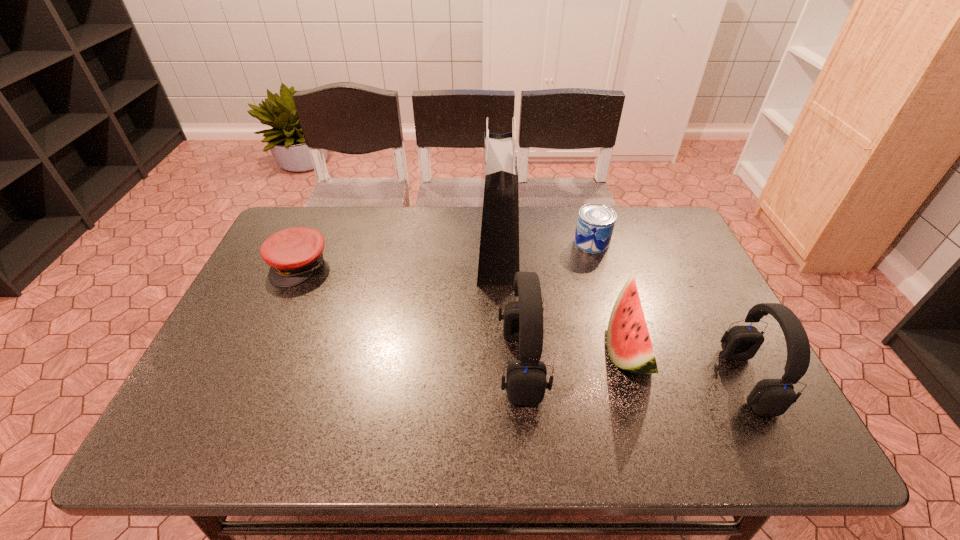
Find the location of `blank space located on the headband of the second tallest object`. blank space located on the headband of the second tallest object is located at coordinates (364, 364).

Find the location of a particular element. Image resolution: width=960 pixels, height=540 pixels. free space located 0.310m on the headband of the second tallest object is located at coordinates (369, 364).

The width and height of the screenshot is (960, 540). What are the coordinates of `free space located 0.190m on the front label of the fifth tallest object` in the screenshot? It's located at (514, 242).

This screenshot has height=540, width=960. What are the coordinates of `free region located on the front label of the fifth tallest object` in the screenshot? It's located at (456, 242).

This screenshot has height=540, width=960. I want to click on free space located 0.290m on the front label of the fifth tallest object, so click(482, 242).

Locate an element on the screen. free space located 0.260m on the front with handles of the shopping bag is located at coordinates (392, 254).

The width and height of the screenshot is (960, 540). Identify the location of vacant space located on the front with handles of the shopping bag. (418, 254).

Where is `vacant space located on the front with handles of the shopping bag`? vacant space located on the front with handles of the shopping bag is located at coordinates (401, 254).

The width and height of the screenshot is (960, 540). Identify the location of vacant space located on the front of the cap with an emblem. coord(263,348).

You are a GUI agent. You are given a task and a screenshot of the screen. Output one action in this format:
    pyautogui.click(x=<x>, y=<y>)
    Task: Click on the free spot located on the outer rind of the fourth tallest object
    This screenshot has width=960, height=540.
    Given the screenshot: What is the action you would take?
    pyautogui.click(x=494, y=349)